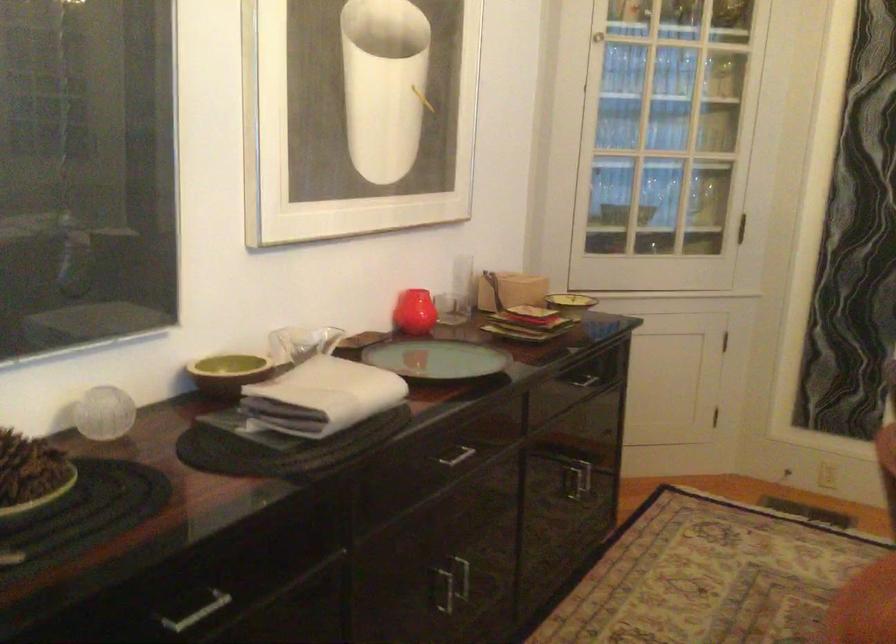
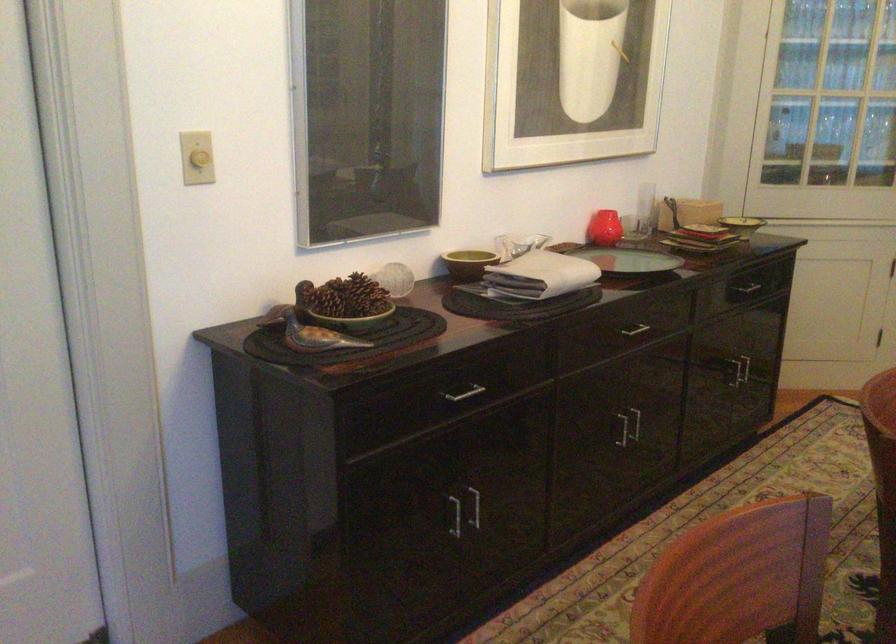
The point at (527, 316) is marked in the first image. Where is the corresponding point in the second image?

(704, 230)